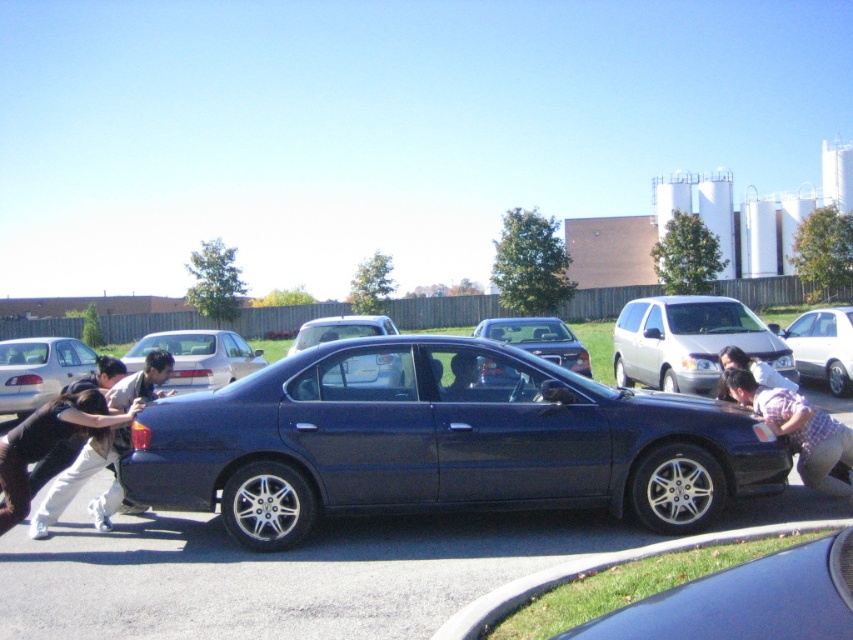
Is silver metallic minivan at center shorter than satin black sedan at center?

Incorrect, silver metallic minivan at center's height does not fall short of satin black sedan at center's.

Identify the location of silver metallic minivan at center. (689, 340).

Where is `silver metallic minivan at center`? The width and height of the screenshot is (853, 640). silver metallic minivan at center is located at coordinates (689, 340).

Which is below, silver metallic minivan at center or silver metallic sedan at center?

silver metallic sedan at center is below.

Between silver metallic minivan at center and silver metallic sedan at center, which one has less height?

With less height is silver metallic sedan at center.

Describe the element at coordinates (689, 340) in the screenshot. This screenshot has width=853, height=640. I see `silver metallic minivan at center` at that location.

Locate an element on the screen. This screenshot has width=853, height=640. silver metallic minivan at center is located at coordinates (689, 340).

Can you confirm if plaid shirt at center is smaller than silver metallic sedan at center?

Indeed, plaid shirt at center has a smaller size compared to silver metallic sedan at center.

Image resolution: width=853 pixels, height=640 pixels. What do you see at coordinates (798, 429) in the screenshot?
I see `plaid shirt at center` at bounding box center [798, 429].

Which is behind, point (746, 387) or point (850, 349)?

Point (850, 349)

Where is `plaid shirt at center`? Image resolution: width=853 pixels, height=640 pixels. plaid shirt at center is located at coordinates (798, 429).